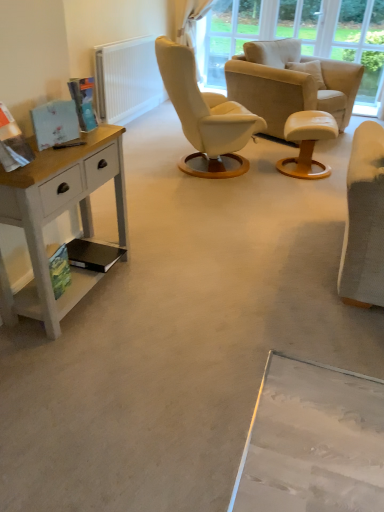
Where is `empty space that is in between white painted wood desk at left and white leather stool at center`? The height and width of the screenshot is (512, 384). empty space that is in between white painted wood desk at left and white leather stool at center is located at coordinates (215, 219).